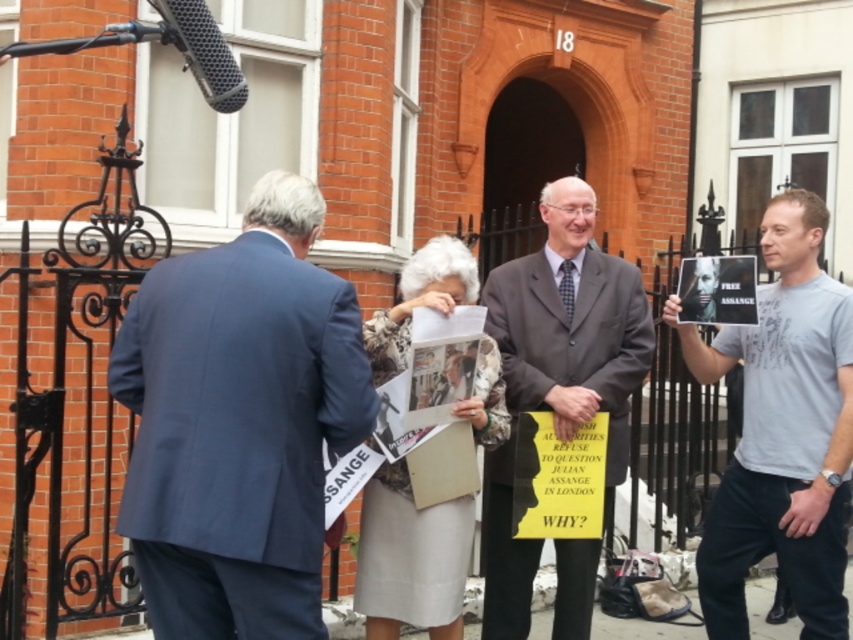
Does dark blue suit at left have a lesser height compared to dark gray suit at center?

Correct, dark blue suit at left is not as tall as dark gray suit at center.

Is dark blue suit at left below dark gray suit at center?

Incorrect, dark blue suit at left is not positioned below dark gray suit at center.

Which is behind, point (300, 472) or point (611, 308)?

The point (611, 308) is more distant.

Locate an element on the screen. dark blue suit at left is located at coordinates [239, 422].

Who is more distant from viewer, (766, 490) or (178, 49)?

Point (766, 490)

Can you confirm if gray cotton t-shirt at right is taller than black metallic microphone at upper left?

Yes, gray cotton t-shirt at right is taller than black metallic microphone at upper left.

Does point (827, 614) come in front of point (209, 22)?

No, it is not.

The width and height of the screenshot is (853, 640). What are the coordinates of `gray cotton t-shirt at right` in the screenshot? It's located at (782, 432).

Does dark blue suit at left have a lesser width compared to gray cotton t-shirt at right?

No.

Does dark blue suit at left appear over gray cotton t-shirt at right?

Indeed, dark blue suit at left is positioned over gray cotton t-shirt at right.

This screenshot has height=640, width=853. In order to click on dark blue suit at left in this screenshot , I will do (239, 422).